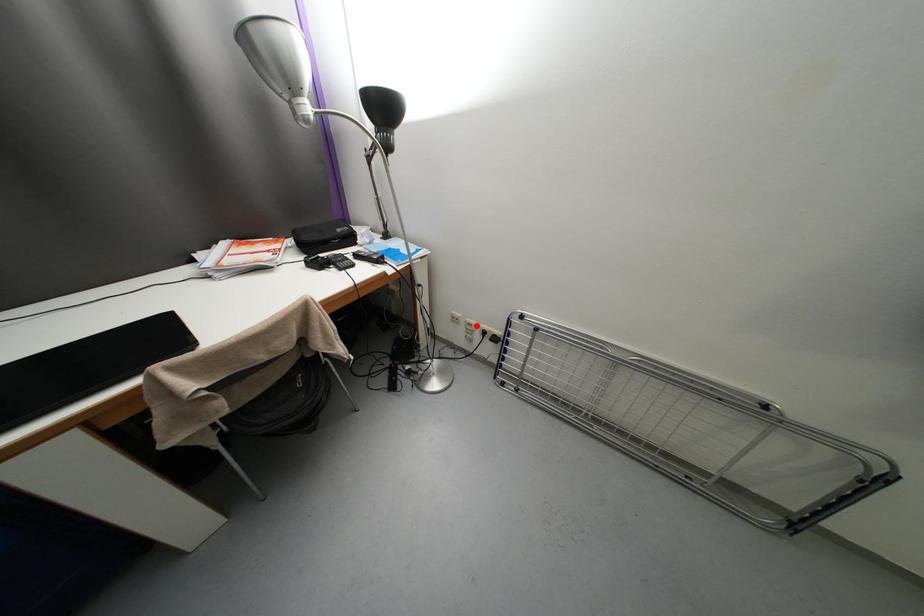
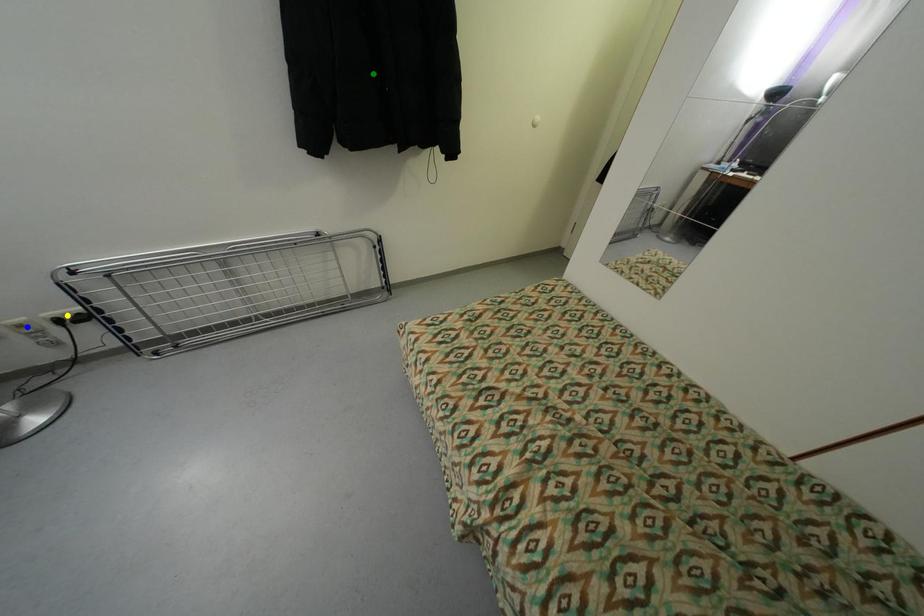
Question: I am providing you with two images of the same scene from different viewpoints. A red point is marked on the first image. You are given multiple points on the second image. Which point in image 2 is actually the same real-world point as the red point in image 1?

Choices:
 (A) yellow point
 (B) green point
 (C) blue point

Answer: (C)